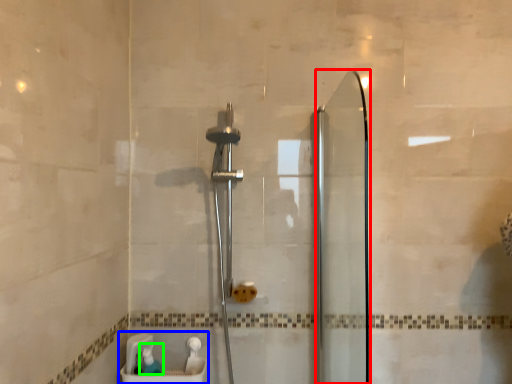
Question: Considering the real-world distances, which object is closest to screen door (highlighted by a red box)? sink (highlighted by a blue box) or toiletry (highlighted by a green box).

Choices:
 (A) sink
 (B) toiletry

Answer: (A)